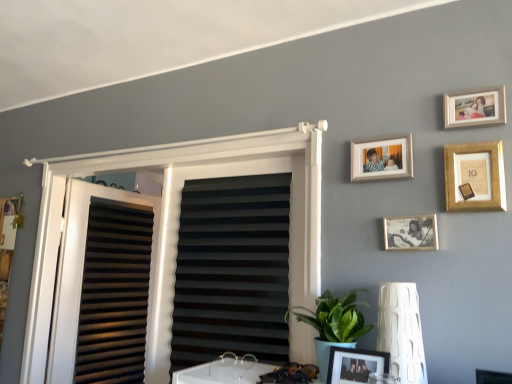
Question: From the image's perspective, is green leafy plant at lower center located above gold metallic picture frame at upper right, the third picture frame from the top?

Choices:
 (A) yes
 (B) no

Answer: (B)

Question: Is the position of green leafy plant at lower center less distant than that of gold metallic picture frame at upper right, the third picture frame from the top?

Choices:
 (A) yes
 (B) no

Answer: (A)

Question: Is green leafy plant at lower center facing towards gold metallic picture frame at upper right, the third picture frame from the top?

Choices:
 (A) no
 (B) yes

Answer: (A)

Question: Is gold metallic picture frame at upper right, the third picture frame from the top, completely or partially inside green leafy plant at lower center?

Choices:
 (A) no
 (B) yes

Answer: (A)

Question: Would you say green leafy plant at lower center is outside gold metallic picture frame at upper right, the third picture frame from the top?

Choices:
 (A) yes
 (B) no

Answer: (A)

Question: Is metallic silver photo frame at center-right, which appears as the 4th picture frame when viewed from the top, inside the boundaries of black matte window blind at center, or outside?

Choices:
 (A) inside
 (B) outside

Answer: (B)

Question: Considering the positions of metallic silver photo frame at center-right, which appears as the 4th picture frame when viewed from the top, and black matte window blind at center in the image, is metallic silver photo frame at center-right, which appears as the 4th picture frame when viewed from the top, taller or shorter than black matte window blind at center?

Choices:
 (A) tall
 (B) short

Answer: (B)

Question: From the image's perspective, is metallic silver photo frame at center-right, which appears as the 4th picture frame when viewed from the top, located above or below black matte window blind at center?

Choices:
 (A) above
 (B) below

Answer: (A)

Question: From a real-world perspective, is metallic silver photo frame at center-right, the second picture frame ordered from the bottom, above or below black matte window blind at center?

Choices:
 (A) below
 (B) above

Answer: (B)

Question: Is white textured lamp at lower right inside the boundaries of black matte window blind at center, or outside?

Choices:
 (A) outside
 (B) inside

Answer: (A)

Question: Considering the positions of point (417, 342) and point (174, 350), is point (417, 342) closer or farther from the camera than point (174, 350)?

Choices:
 (A) farther
 (B) closer

Answer: (B)

Question: From their relative heights in the image, would you say white textured lamp at lower right is taller or shorter than black matte window blind at center?

Choices:
 (A) short
 (B) tall

Answer: (A)

Question: Looking at their shapes, would you say white textured lamp at lower right is wider or thinner than black matte window blind at center?

Choices:
 (A) thin
 (B) wide

Answer: (B)

Question: In terms of width, does white plastic window frame at upper center look wider or thinner when compared to white textured lamp at lower right?

Choices:
 (A) wide
 (B) thin

Answer: (B)

Question: Does point (35, 288) appear closer or farther from the camera than point (391, 334)?

Choices:
 (A) farther
 (B) closer

Answer: (A)